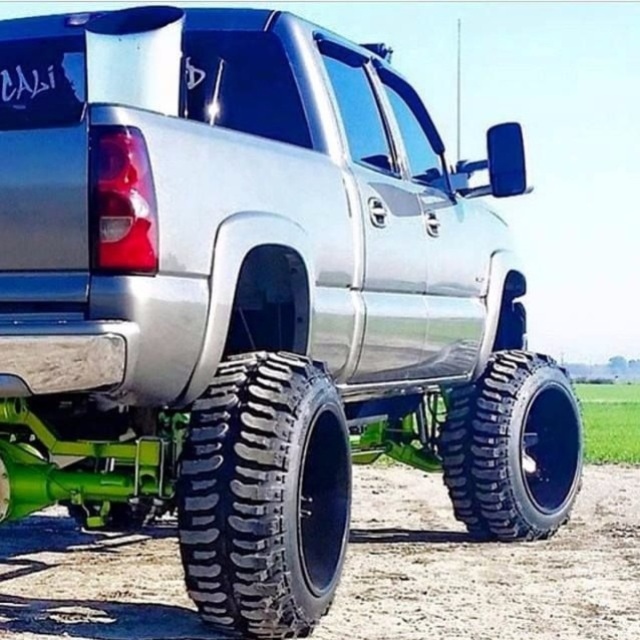
Question: Which of the following is the farthest from the observer?

Choices:
 (A) black rubber tire at lower right
 (B) black rubber tire at lower left

Answer: (A)

Question: Considering the real-world distances, which object is farthest from the black rubber tire at lower right?

Choices:
 (A) dirtloose/granular at lower center
 (B) black rubber tire at lower left
 (C) black matte license plate at rear

Answer: (C)

Question: Can you confirm if dirtloose/granular at lower center is thinner than black rubber tire at lower right?

Choices:
 (A) yes
 (B) no

Answer: (B)

Question: Does black rubber tire at lower right lie in front of black matte license plate at rear?

Choices:
 (A) no
 (B) yes

Answer: (A)

Question: Can you confirm if black rubber tire at lower left is positioned to the left of black rubber tire at lower right?

Choices:
 (A) no
 (B) yes

Answer: (B)

Question: Which point is closer to the camera taking this photo?

Choices:
 (A) (500, 628)
 (B) (116, 237)
 (C) (509, 420)

Answer: (B)